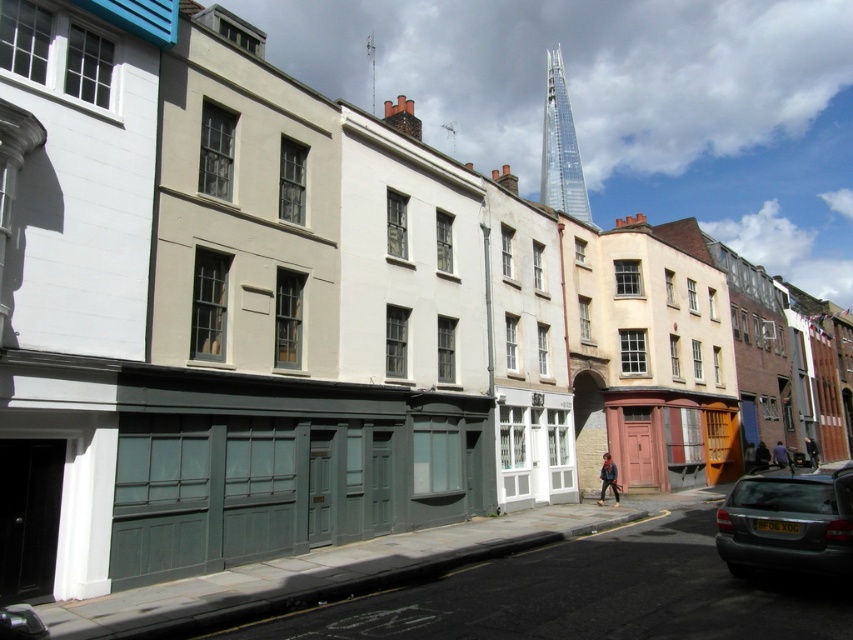
You are standing at the center of the street and want to park your matte gray car at lower right. Which direction should you drive to reach its current location?

The matte gray car at lower right is located at point (787,524), so you should drive towards the lower right direction to reach it.

You are standing at the point closest to the camera in this historic street scene. Which of the two points, point (815, 557) or point (556, 116), are you currently standing at?

You are standing at point (815, 557) because it is closer to the camera than point (556, 116).